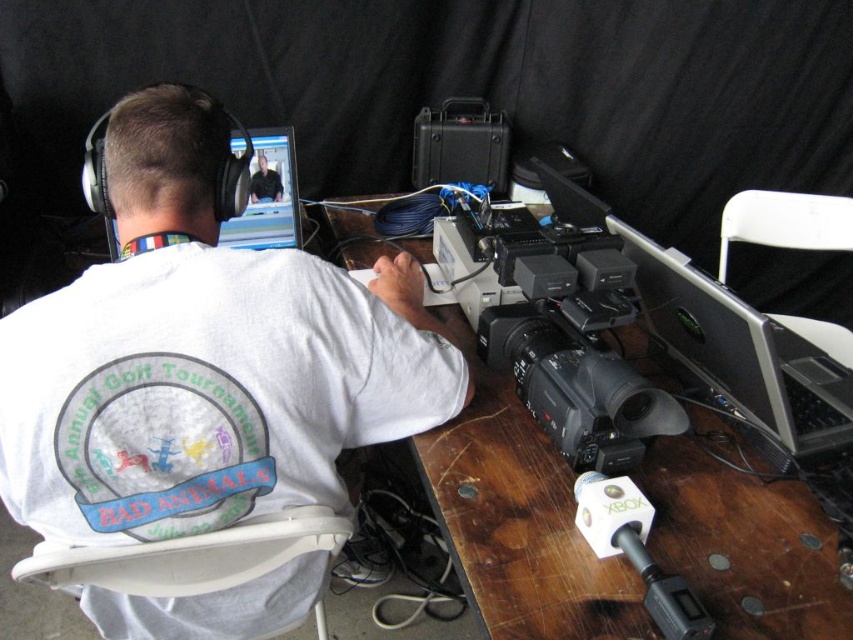
Who is positioned more to the right, white cotton shirt at center or wooden table at center?

wooden table at center is more to the right.

Who is higher up, white cotton shirt at center or wooden table at center?

white cotton shirt at center

Locate an element on the screen. white cotton shirt at center is located at coordinates (204, 356).

The image size is (853, 640). In order to click on white cotton shirt at center in this screenshot , I will do `click(204, 356)`.

Is wooden table at center shorter than matte black monitor at upper center?

In fact, wooden table at center may be taller than matte black monitor at upper center.

Which is behind, point (762, 620) or point (289, 186)?

The point (289, 186) is more distant.

Is point (728, 432) positioned in front of point (271, 163)?

Yes, point (728, 432) is in front of point (271, 163).

This screenshot has height=640, width=853. Find the location of `wooden table at center`. wooden table at center is located at coordinates (520, 528).

Can you confirm if black plastic camera at center is positioned to the right of matte black monitor at upper center?

Yes, black plastic camera at center is to the right of matte black monitor at upper center.

Is black plastic camera at center positioned in front of matte black monitor at upper center?

Yes, black plastic camera at center is in front of matte black monitor at upper center.

Is point (550, 358) closer to camera compared to point (265, 186)?

Yes.

You are a GUI agent. You are given a task and a screenshot of the screen. Output one action in this format:
    pyautogui.click(x=<x>, y=<y>)
    Task: Click on the black plastic camera at center
    This screenshot has height=640, width=853.
    Given the screenshot: What is the action you would take?
    pyautogui.click(x=577, y=387)